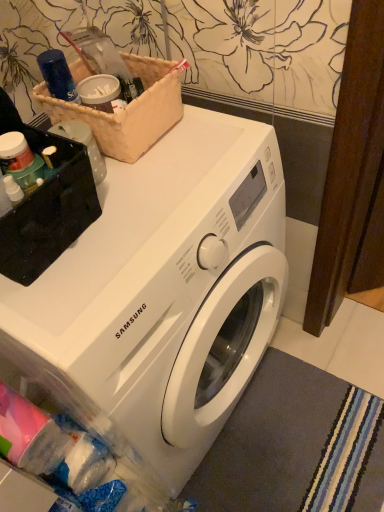
Find the location of `vacant area located to the right-hand side of brown woven basket at upper left`. vacant area located to the right-hand side of brown woven basket at upper left is located at coordinates (216, 134).